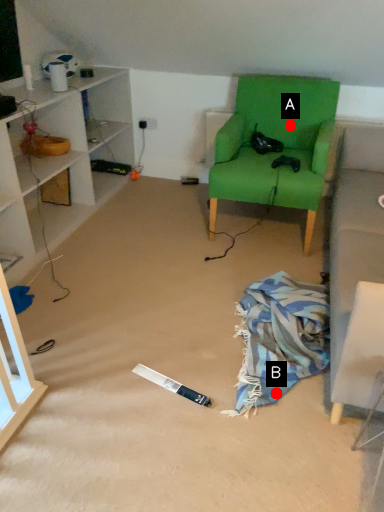
Question: Two points are circled on the image, labeled by A and B beside each circle. Which point is farther to the camera?

Choices:
 (A) A is further
 (B) B is further

Answer: (A)